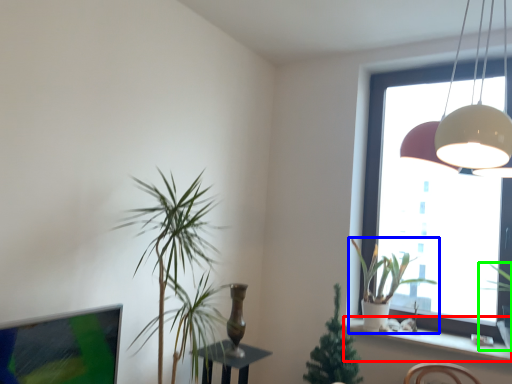
Question: Which object is positioned farthest from window sill (highlighted by a red box)? Select from houseplant (highlighted by a blue box) and houseplant (highlighted by a green box).

Choices:
 (A) houseplant
 (B) houseplant

Answer: (B)